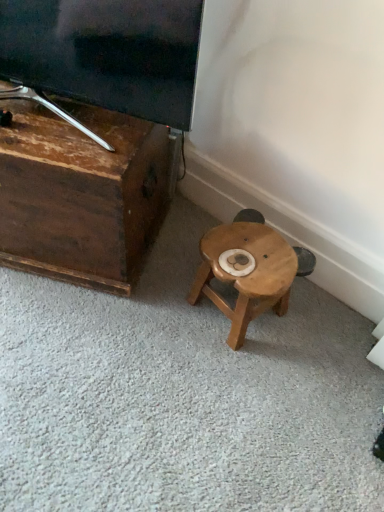
Question: From the image's perspective, is wooden stool at center on top of dark brown wood tv stand at left?

Choices:
 (A) no
 (B) yes

Answer: (A)

Question: Considering the relative sizes of wooden stool at center and dark brown wood tv stand at left in the image provided, is wooden stool at center shorter than dark brown wood tv stand at left?

Choices:
 (A) yes
 (B) no

Answer: (A)

Question: Does wooden stool at center have a smaller size compared to dark brown wood tv stand at left?

Choices:
 (A) yes
 (B) no

Answer: (A)

Question: From the image's perspective, does wooden stool at center appear lower than dark brown wood tv stand at left?

Choices:
 (A) no
 (B) yes

Answer: (B)

Question: From a real-world perspective, is wooden stool at center under dark brown wood tv stand at left?

Choices:
 (A) no
 (B) yes

Answer: (B)

Question: Is dark brown wood tv stand at left at the back of wooden stool at center?

Choices:
 (A) no
 (B) yes

Answer: (A)

Question: Can you confirm if dark brown wood tv stand at left is taller than wooden stool at center?

Choices:
 (A) no
 (B) yes

Answer: (B)

Question: Would you say dark brown wood tv stand at left contains wooden stool at center?

Choices:
 (A) no
 (B) yes

Answer: (A)

Question: Does dark brown wood tv stand at left have a smaller size compared to wooden stool at center?

Choices:
 (A) yes
 (B) no

Answer: (B)

Question: From the image's perspective, is dark brown wood tv stand at left above wooden stool at center?

Choices:
 (A) yes
 (B) no

Answer: (A)

Question: Is dark brown wood tv stand at left outside wooden stool at center?

Choices:
 (A) yes
 (B) no

Answer: (A)

Question: Is dark brown wood tv stand at left shorter than wooden stool at center?

Choices:
 (A) yes
 (B) no

Answer: (B)

Question: Do you think dark brown wood tv stand at left is within wooden stool at center, or outside of it?

Choices:
 (A) outside
 (B) inside

Answer: (A)